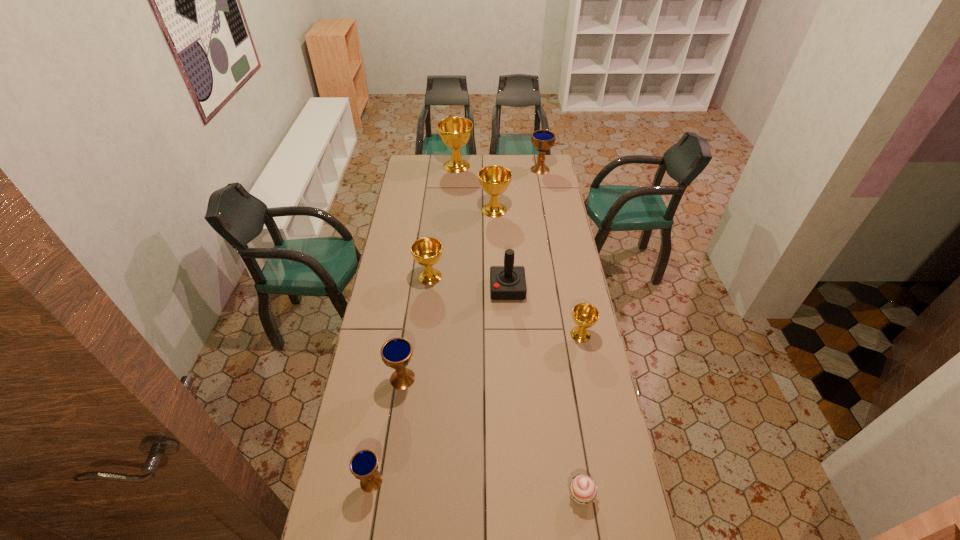
In the image, there is a desktop. At what (x,y) coordinates should I click in order to perform the action: click on vacant space at the far edge. Please return your answer as a coordinate pair (x, y). Image resolution: width=960 pixels, height=540 pixels. Looking at the image, I should click on (449, 174).

Locate an element on the screen. The height and width of the screenshot is (540, 960). vacant area at the left edge of the desktop is located at coordinates (426, 188).

In the image, there is a desktop. Find the location of `vacant space at the right edge`. vacant space at the right edge is located at coordinates (552, 202).

Where is `free space between the fourth farthest chalice and the joystick`? The height and width of the screenshot is (540, 960). free space between the fourth farthest chalice and the joystick is located at coordinates (468, 282).

Where is `vacant region between the fifth farthest chalice and the tallest chalice`? vacant region between the fifth farthest chalice and the tallest chalice is located at coordinates (518, 250).

Identify the location of unoccupied position between the third farthest chalice and the second smallest blue chalice. (448, 294).

What are the coordinates of `unoccupied position between the third biggest gold chalice and the biggest blue chalice` in the screenshot? It's located at (485, 223).

I want to click on free space between the nearest gold chalice and the cupcake, so click(x=581, y=415).

The height and width of the screenshot is (540, 960). What are the coordinates of `free area in between the fourth nearest object and the tallest chalice` in the screenshot? It's located at (518, 250).

This screenshot has width=960, height=540. What are the coordinates of `free space between the red joystick and the sixth farthest chalice` in the screenshot? It's located at (455, 334).